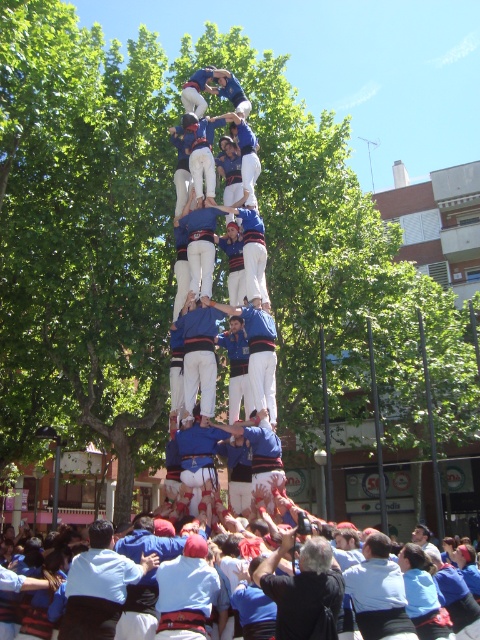
Looking at this image, who is more distant from viewer, (84,604) or (257,365)?

The point (257,365) is behind.

From the picture: How distant is blue cotton shirt at lower left from blue cotton shirt at center?

A distance of 39.85 feet exists between blue cotton shirt at lower left and blue cotton shirt at center.

Between point (86, 550) and point (269, 401), which one is positioned in front?

Positioned in front is point (86, 550).

Identify the location of blue cotton shirt at lower left. (98, 586).

Does blue shirt at center lie behind blue cotton shirt at center?

No, blue shirt at center is closer to the viewer.

Who is shorter, blue shirt at center or blue cotton shirt at center?

blue shirt at center

The image size is (480, 640). I want to click on blue shirt at center, so click(379, 593).

Between blue cotton shirt at lower left and dark blue shirt at center, which one is positioned higher?

dark blue shirt at center is higher up.

Is blue cotton shirt at lower left closer to camera compared to dark blue shirt at center?

No, it is behind dark blue shirt at center.

The width and height of the screenshot is (480, 640). What do you see at coordinates (98, 586) in the screenshot?
I see `blue cotton shirt at lower left` at bounding box center [98, 586].

What are the coordinates of `blue cotton shirt at lower left` in the screenshot? It's located at (98, 586).